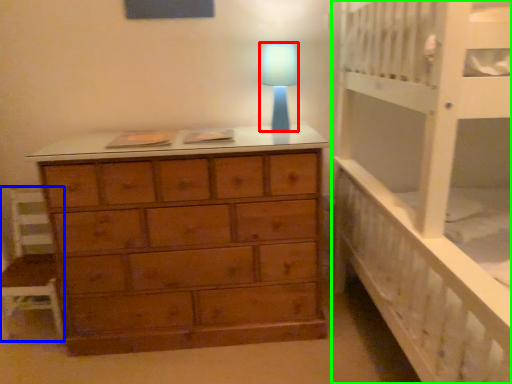
Question: Which is nearer to the lamp (highlighted by a red box)? chair (highlighted by a blue box) or bed (highlighted by a green box).

Choices:
 (A) chair
 (B) bed

Answer: (B)